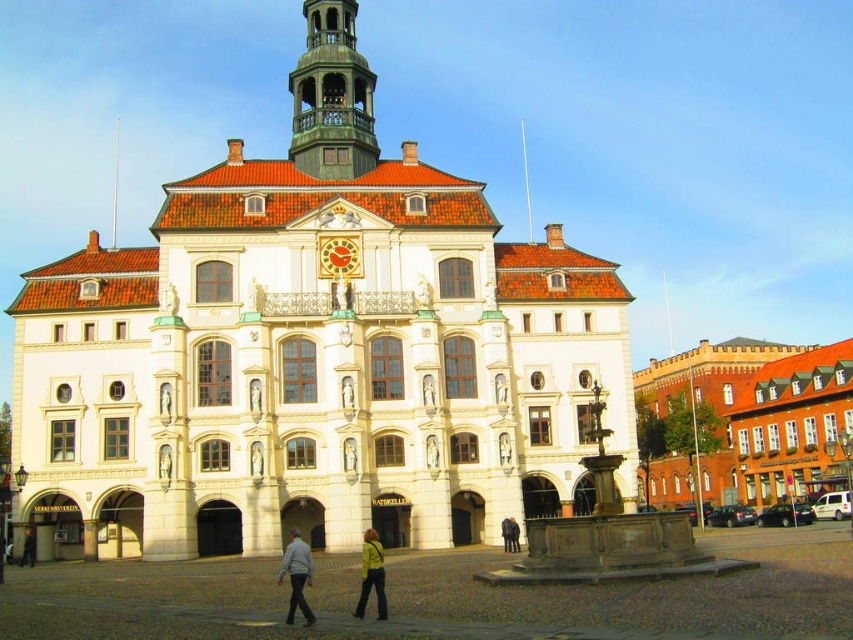
You are a fashion designer attending an event at the historic building and notice two jackets displayed on mannequins. The yellow leather jacket at lower center and the green fabric jacket at center. Which jacket appears taller when viewed from the entrance of the building?

The yellow leather jacket at lower center appears taller than the green fabric jacket at center because it is much taller as stated in the description.

In the scene shown: You are a tourist visiting the historic area and want to take a photo that includes both the white stone building at center and the green wooden bell tower at upper center. Which object should you position closer to the camera to ensure both are fully visible in the frame?

You should position the green wooden bell tower at upper center closer to the camera because it is smaller in size than the white stone building at center, allowing both to fit within the frame.